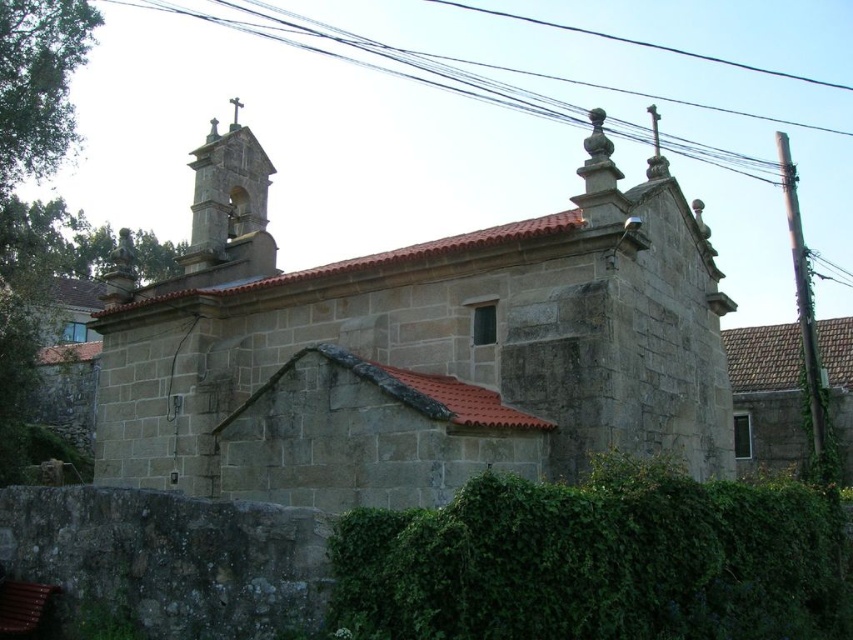
You are standing in a rural area and see the stone church at center and the green leafy hedge at lower center. Which object is located to the east of the other?

The stone church at center is positioned on the left side of green leafy hedge at lower center. Since the hedge is at lower center, the church being on its left implies it is to the east if the hedge is facing north. However, without knowing the hedge or church orientation, we cannot definitively determine the east direction. The question requires more information about their orientation relative to cardinal directions.

You are a photographer planning to take a wide shot of the stone church at center. You notice there is a green leafy hedge at lower center in the foreground. Will the hedge block the view of the church in your photo?

The stone church at center is larger in size than the green leafy hedge at lower center, so the hedge will not block the entire view of the church in the photo.